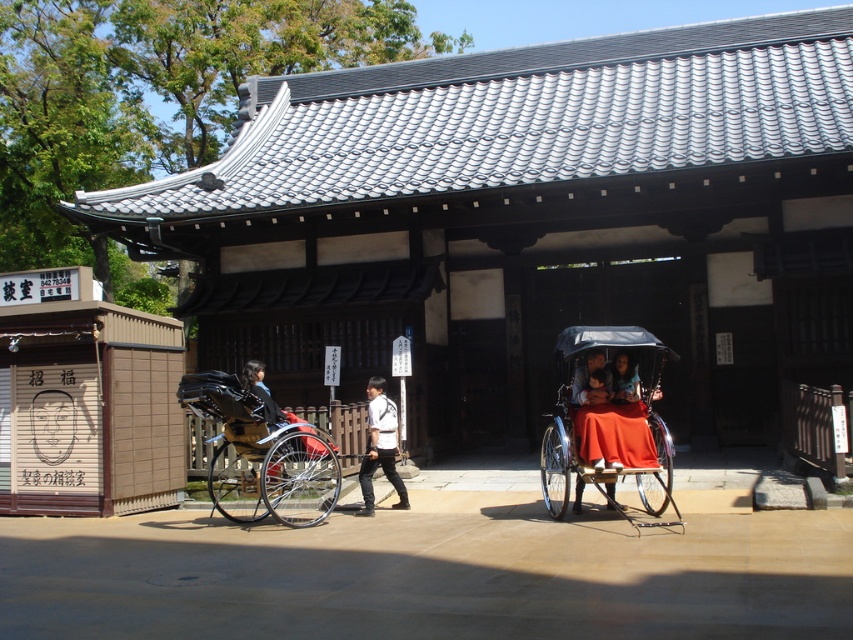
Can you confirm if orange fabric covered cart at center is smaller than wooden cart at center?

Indeed, orange fabric covered cart at center has a smaller size compared to wooden cart at center.

Does orange fabric covered cart at center lie behind wooden cart at center?

No, it is not.

Where is `orange fabric covered cart at center`? This screenshot has width=853, height=640. orange fabric covered cart at center is located at coordinates (607, 419).

Is wooden cart at center bigger than white matte shirt at center?

Indeed, wooden cart at center has a larger size compared to white matte shirt at center.

Is wooden cart at center smaller than white matte shirt at center?

No.

Is point (242, 516) positioned before point (384, 432)?

No, (242, 516) is further to viewer.

Locate an element on the screen. wooden cart at center is located at coordinates (262, 452).

Which is in front, point (602, 356) or point (397, 420)?

Point (602, 356) is more forward.

Is orange fabric covered cart at center thinner than white matte shirt at center?

Incorrect, orange fabric covered cart at center's width is not less than white matte shirt at center's.

Is point (579, 394) closer to viewer compared to point (369, 460)?

Yes, it is.

This screenshot has height=640, width=853. I want to click on orange fabric covered cart at center, so click(x=607, y=419).